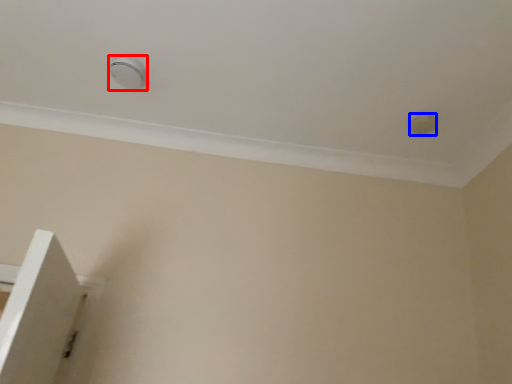
Question: Among these objects, which one is nearest to the camera, knob (highlighted by a red box) or knob (highlighted by a blue box)?

Choices:
 (A) knob
 (B) knob

Answer: (A)